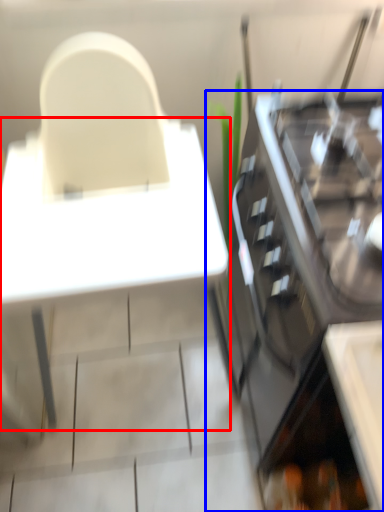
Question: Which object appears farthest to the camera in this image, table (highlighted by a red box) or cabinetry (highlighted by a blue box)?

Choices:
 (A) table
 (B) cabinetry

Answer: (B)